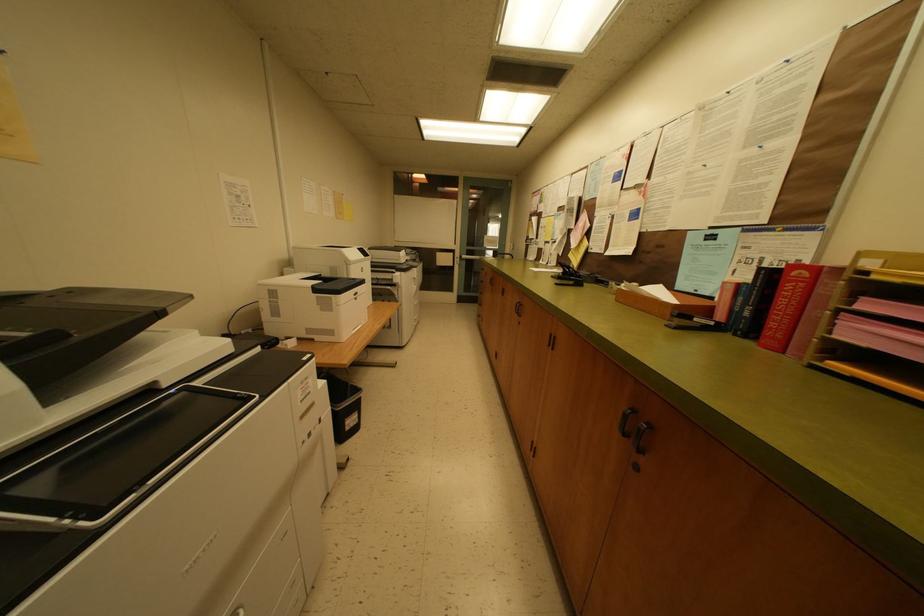
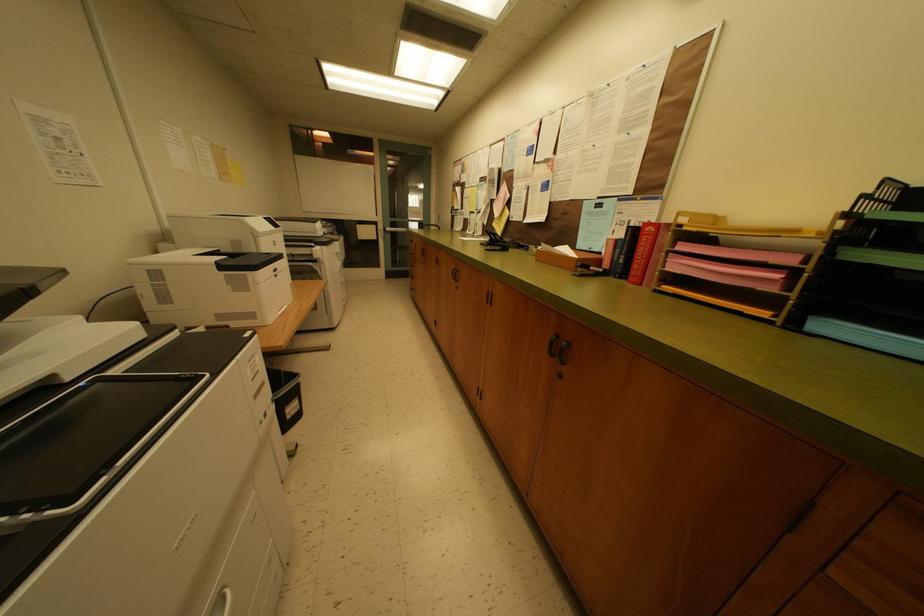
The images are taken continuously from a first-person perspective. In which direction are you moving?

The cameraman moved toward left, backward.